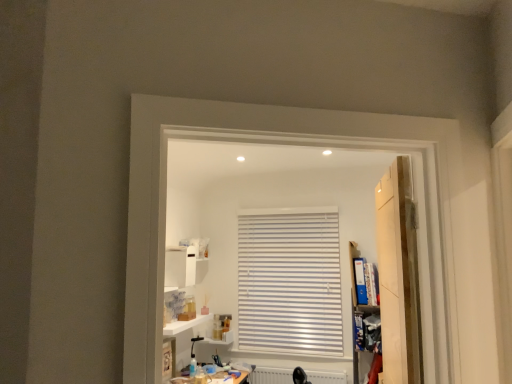
Question: Should I look upward or downward to see white glossy cabinet at upper center?

Choices:
 (A) up
 (B) down

Answer: (B)

Question: Is white glossy cabinet at upper center smaller than white glossy shelf at lower center?

Choices:
 (A) no
 (B) yes

Answer: (A)

Question: Does white glossy cabinet at upper center turn towards white glossy shelf at lower center?

Choices:
 (A) yes
 (B) no

Answer: (B)

Question: Is white glossy cabinet at upper center at the left side of white glossy shelf at lower center?

Choices:
 (A) yes
 (B) no

Answer: (A)

Question: From a real-world perspective, is white glossy cabinet at upper center on white glossy shelf at lower center?

Choices:
 (A) no
 (B) yes

Answer: (B)

Question: Can you confirm if white glossy cabinet at upper center is wider than white glossy shelf at lower center?

Choices:
 (A) no
 (B) yes

Answer: (A)

Question: Can you confirm if white glossy cabinet at upper center is taller than white glossy shelf at lower center?

Choices:
 (A) yes
 (B) no

Answer: (A)

Question: From the image's perspective, is white matte radiator at lower center on white glossy shelf at lower center?

Choices:
 (A) no
 (B) yes

Answer: (A)

Question: Is white matte radiator at lower center in front of white glossy shelf at lower center?

Choices:
 (A) yes
 (B) no

Answer: (B)

Question: Is white matte radiator at lower center thinner than white glossy shelf at lower center?

Choices:
 (A) no
 (B) yes

Answer: (B)

Question: Considering the relative sizes of white matte radiator at lower center and white glossy shelf at lower center in the image provided, is white matte radiator at lower center bigger than white glossy shelf at lower center?

Choices:
 (A) no
 (B) yes

Answer: (B)

Question: Could you tell me if white matte radiator at lower center is facing white glossy shelf at lower center?

Choices:
 (A) no
 (B) yes

Answer: (A)

Question: From the image's perspective, does white matte radiator at lower center appear lower than white glossy shelf at lower center?

Choices:
 (A) no
 (B) yes

Answer: (B)

Question: Considering the relative sizes of wooden door at right and white glossy cabinet at upper center in the image provided, is wooden door at right wider than white glossy cabinet at upper center?

Choices:
 (A) no
 (B) yes

Answer: (A)